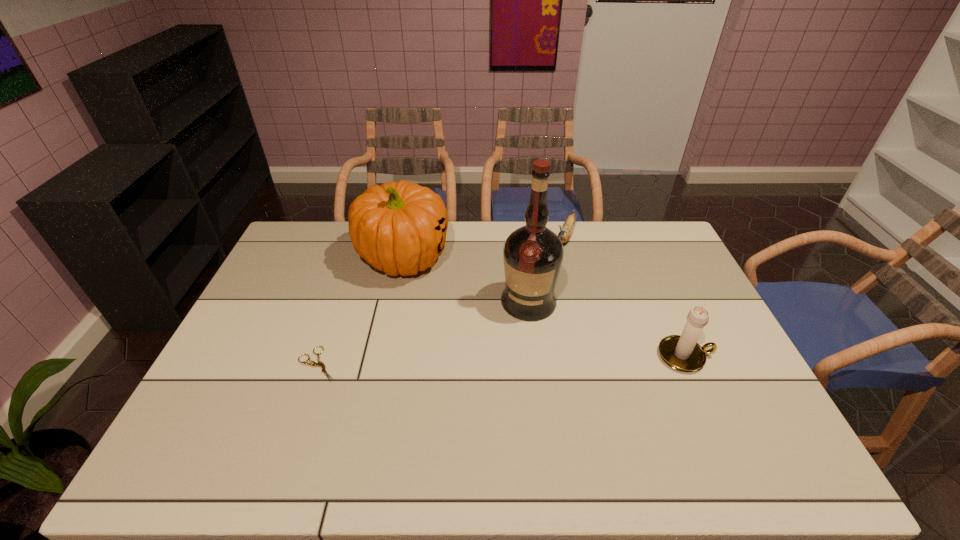
Find the location of `object present at the right edge`. object present at the right edge is located at coordinates (681, 352).

At what (x,y) coordinates should I click in order to perform the action: click on free space at the far edge of the desktop. Please return your answer as a coordinate pair (x, y). Looking at the image, I should click on (581, 230).

The image size is (960, 540). Identify the location of free space at the near edge of the desktop. (704, 418).

In the image, there is a desktop. Identify the location of vacant space at the left edge. (264, 326).

The height and width of the screenshot is (540, 960). I want to click on vacant space at the right edge of the desktop, so click(x=707, y=336).

You are a GUI agent. You are given a task and a screenshot of the screen. Output one action in this format:
    pyautogui.click(x=<x>, y=<y>)
    Task: Click on the free space at the far left corner of the desktop
    The height and width of the screenshot is (540, 960).
    Given the screenshot: What is the action you would take?
    pyautogui.click(x=324, y=235)

This screenshot has height=540, width=960. I want to click on free location at the far right corner of the desktop, so click(x=660, y=239).

Find the location of a particular element. free space between the third object from right to left and the third shortest object is located at coordinates (607, 329).

At what (x,y) coordinates should I click in order to perform the action: click on free space that is in between the liquor and the candle holder. Please return your answer as a coordinate pair (x, y). The width and height of the screenshot is (960, 540). Looking at the image, I should click on (607, 329).

Image resolution: width=960 pixels, height=540 pixels. Identify the location of vacant area that lies between the shears and the pumpkin. pyautogui.click(x=360, y=310).